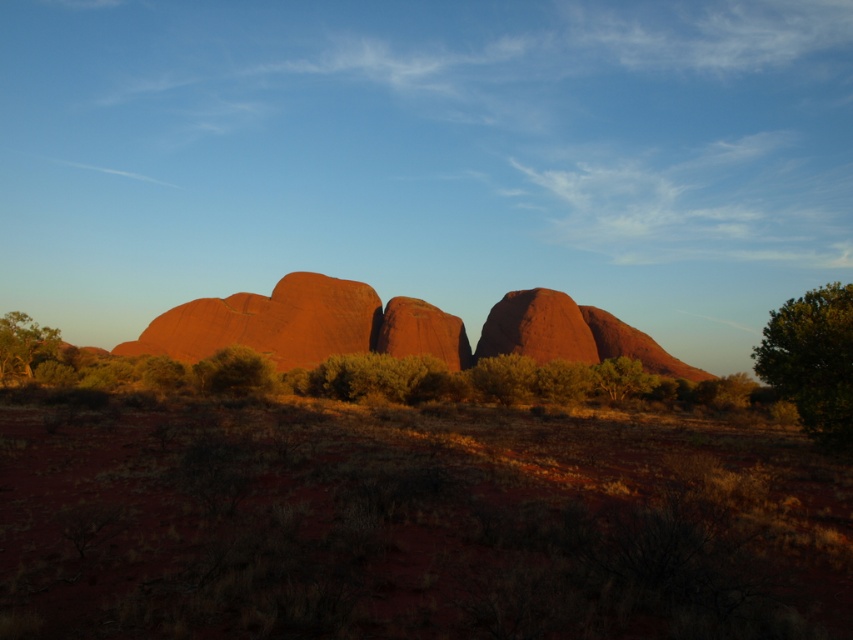
Can you confirm if rustic sandstone rock formation at center is smaller than green leafy shrub at lower left?

No.

This screenshot has width=853, height=640. Find the location of `rustic sandstone rock formation at center`. rustic sandstone rock formation at center is located at coordinates (393, 326).

Where is `rustic sandstone rock formation at center`? The height and width of the screenshot is (640, 853). rustic sandstone rock formation at center is located at coordinates pos(393,326).

Is dried grass at center closer to camera compared to green leafy tree at right?

Yes, it is in front of green leafy tree at right.

Is dried grass at center shorter than green leafy tree at right?

Yes.

The image size is (853, 640). In order to click on dried grass at center in this screenshot , I will do `click(410, 522)`.

Can you confirm if rustic sandstone rock formation at center is positioned to the left of green leafy tree at right?

Indeed, rustic sandstone rock formation at center is positioned on the left side of green leafy tree at right.

Is point (616, 330) behind point (762, 330)?

Yes, point (616, 330) is farther from viewer.

You are a GUI agent. You are given a task and a screenshot of the screen. Output one action in this format:
    pyautogui.click(x=<x>, y=<y>)
    Task: Click on the rustic sandstone rock formation at center
    
    Given the screenshot: What is the action you would take?
    pyautogui.click(x=393, y=326)